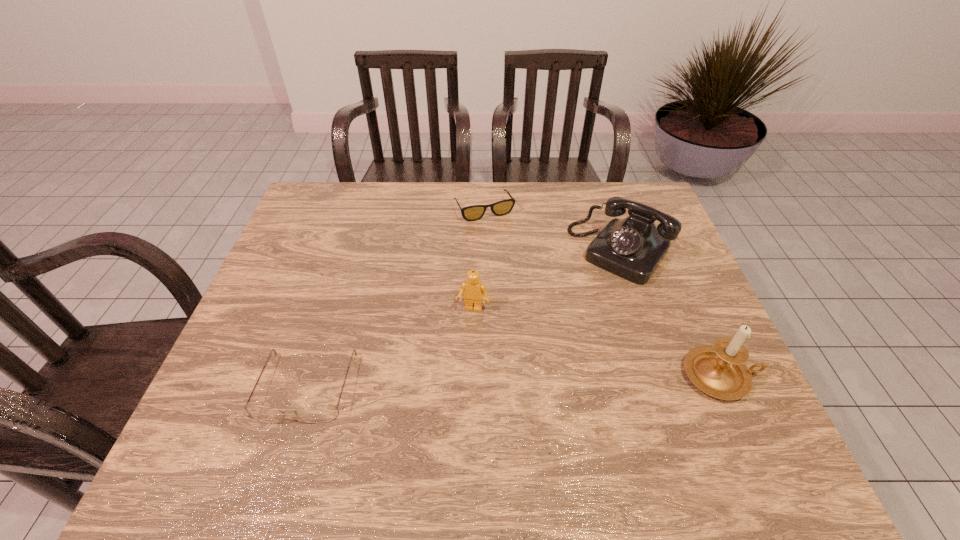
Locate an element on the screen. This screenshot has width=960, height=540. the leftmost object is located at coordinates (323, 413).

Find the location of `the tallest object`. the tallest object is located at coordinates (719, 371).

At what (x,y) coordinates should I click in order to perform the action: click on telephone. Please return your answer as a coordinate pair (x, y). The height and width of the screenshot is (540, 960). Looking at the image, I should click on (632, 248).

Locate an element on the screen. The height and width of the screenshot is (540, 960). sunglasses is located at coordinates tap(470, 213).

Where is `the third shortest object`? Image resolution: width=960 pixels, height=540 pixels. the third shortest object is located at coordinates (473, 289).

Image resolution: width=960 pixels, height=540 pixels. What are the coordinates of `Lego` in the screenshot? It's located at (473, 289).

Locate an element on the screen. The image size is (960, 540). free spot located 0.050m on the dial of the telephone is located at coordinates (589, 288).

The height and width of the screenshot is (540, 960). Identify the location of vacant point located 0.350m on the dial of the telephone. (530, 363).

Identify the location of free location located 0.390m on the dial of the telephone. (520, 375).

The width and height of the screenshot is (960, 540). Find the location of `vacant space located 0.170m on the front-facing side of the sunglasses`. vacant space located 0.170m on the front-facing side of the sunglasses is located at coordinates (512, 258).